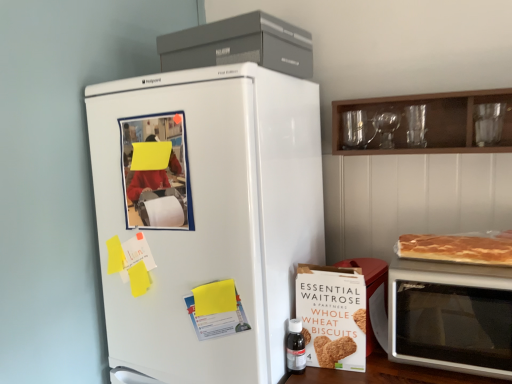
Question: From the image's perspective, is silver metallic microwave at right on top of wooden cabinet at upper right?

Choices:
 (A) no
 (B) yes

Answer: (A)

Question: Can we say silver metallic microwave at right lies outside wooden cabinet at upper right?

Choices:
 (A) no
 (B) yes

Answer: (B)

Question: Can you confirm if silver metallic microwave at right is thinner than wooden cabinet at upper right?

Choices:
 (A) yes
 (B) no

Answer: (B)

Question: Does silver metallic microwave at right lie in front of wooden cabinet at upper right?

Choices:
 (A) no
 (B) yes

Answer: (B)

Question: Is silver metallic microwave at right taller than wooden cabinet at upper right?

Choices:
 (A) yes
 (B) no

Answer: (A)

Question: Is silver metallic microwave at right facing towards wooden cabinet at upper right?

Choices:
 (A) yes
 (B) no

Answer: (B)

Question: Is silver metallic microwave at right oriented away from white matte refrigerator at left?

Choices:
 (A) yes
 (B) no

Answer: (B)

Question: Does silver metallic microwave at right lie behind white matte refrigerator at left?

Choices:
 (A) no
 (B) yes

Answer: (B)

Question: Considering the relative sizes of silver metallic microwave at right and white matte refrigerator at left in the image provided, is silver metallic microwave at right bigger than white matte refrigerator at left?

Choices:
 (A) yes
 (B) no

Answer: (B)

Question: Is silver metallic microwave at right smaller than white matte refrigerator at left?

Choices:
 (A) no
 (B) yes

Answer: (B)

Question: Considering the relative positions of silver metallic microwave at right and white matte refrigerator at left in the image provided, is silver metallic microwave at right to the left of white matte refrigerator at left from the viewer's perspective?

Choices:
 (A) no
 (B) yes

Answer: (A)

Question: Is silver metallic microwave at right surrounding white matte refrigerator at left?

Choices:
 (A) no
 (B) yes

Answer: (A)

Question: Would you consider silver metallic microwave at right to be distant from transparent plastic bottle at lower right?

Choices:
 (A) yes
 (B) no

Answer: (B)